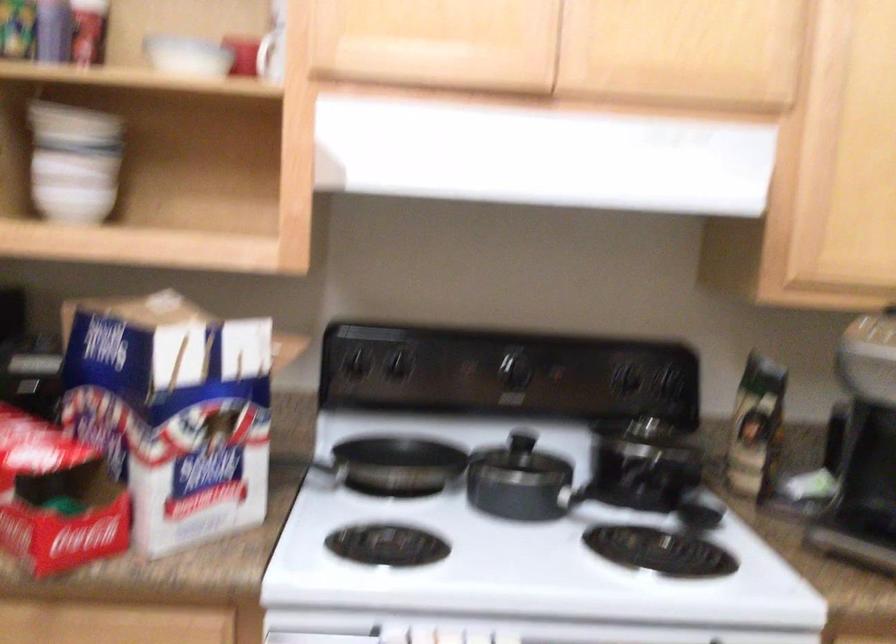
Where would you lift the saucepan handle? Please return your answer as a coordinate pair (x, y).

(300, 462)